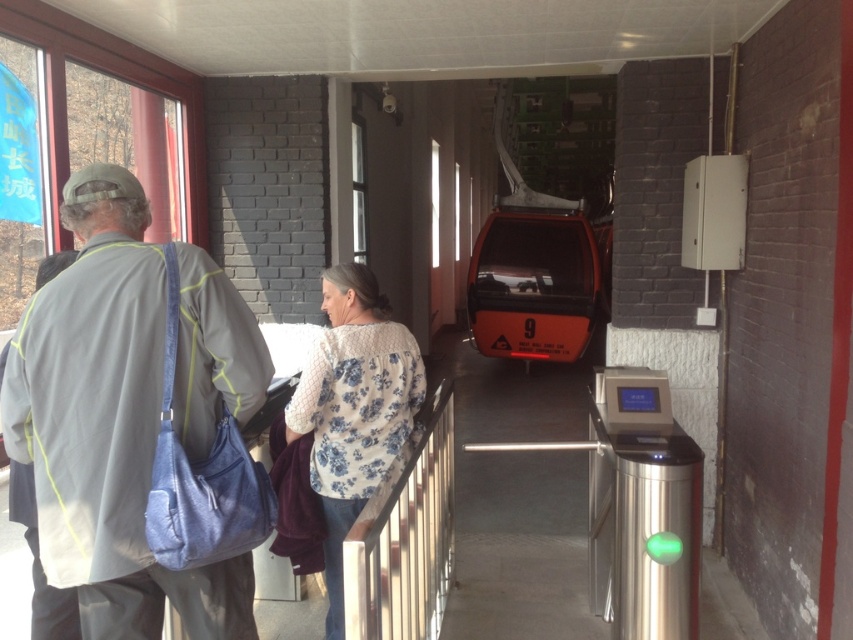
You are a designer trying to place a new sign in the cable car station. The sign needs to be placed to the right of the light gray fabric jacket at left. Where should the sign be positioned relative to the jacket?

The light gray fabric jacket at left is located at point (107, 426). Therefore, the sign should be placed to the right of this coordinate.